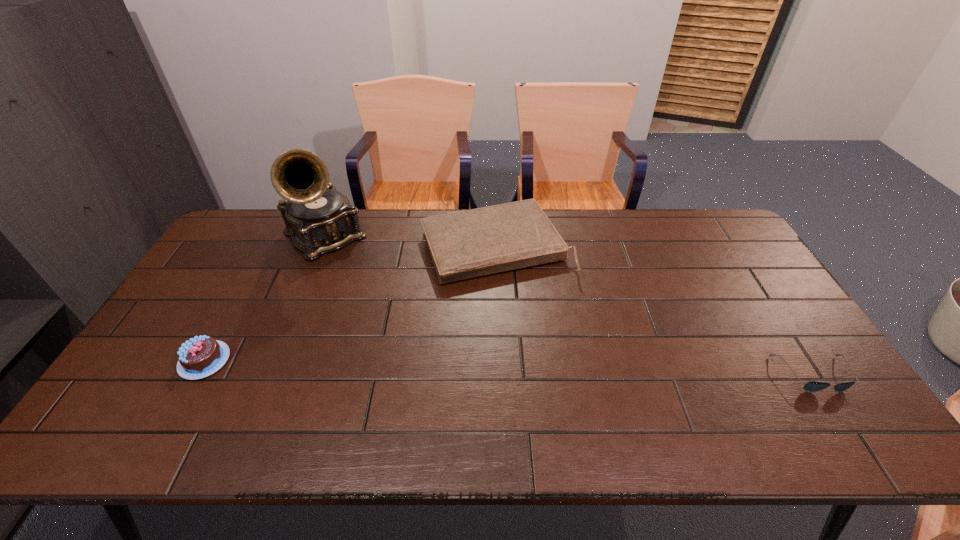
You are a GUI agent. You are given a task and a screenshot of the screen. Output one action in this format:
    pyautogui.click(x=<x>, y=<y>)
    Task: Click on the chocolate cake
    This screenshot has height=540, width=960.
    Given the screenshot: What is the action you would take?
    pyautogui.click(x=199, y=357)

At what (x,y) coordinates should I click in order to perform the action: click on the rightmost object. Please return your answer as a coordinate pair (x, y). This screenshot has width=960, height=540. Looking at the image, I should click on pyautogui.click(x=812, y=386).

What are the coordinates of `the shortest object` in the screenshot? It's located at (812, 386).

Find the location of a particular element. the second object from right to left is located at coordinates (472, 243).

Image resolution: width=960 pixels, height=540 pixels. In order to click on the tallest object in this screenshot , I will do `click(319, 219)`.

Locate an element on the screen. This screenshot has width=960, height=540. vacant space located 0.270m on the back of the chocolate cake is located at coordinates (252, 274).

This screenshot has width=960, height=540. Identify the location of free space located 0.220m on the spine side of the second object from right to left. (550, 340).

This screenshot has width=960, height=540. In order to click on free location located 0.290m on the spine side of the second object from right to left in this screenshot , I will do `click(562, 360)`.

You are a GUI agent. You are given a task and a screenshot of the screen. Output one action in this format:
    pyautogui.click(x=<x>, y=<y>)
    Task: Click on the free location located on the spine side of the second object from right to left
    
    Given the screenshot: What is the action you would take?
    pyautogui.click(x=527, y=297)

Locate an element on the screen. The image size is (960, 540). free space located on the horn of the phonograph record is located at coordinates (393, 316).